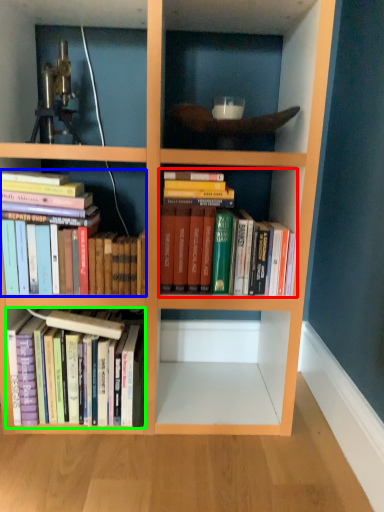
Question: Which object is the closest to the book (highlighted by a red box)? Choose among these: book (highlighted by a blue box) or book (highlighted by a green box).

Choices:
 (A) book
 (B) book

Answer: (A)